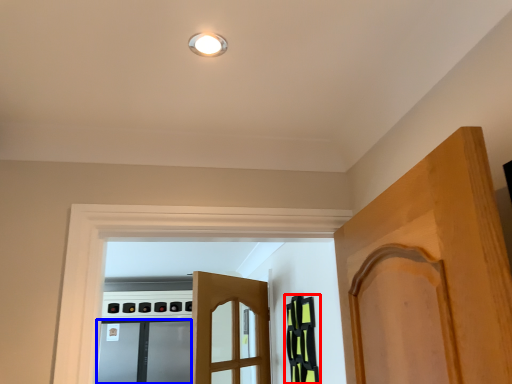
Question: Which object is closer to the camera taking this photo, cabinetry (highlighted by a red box) or screen door (highlighted by a blue box)?

Choices:
 (A) cabinetry
 (B) screen door

Answer: (A)